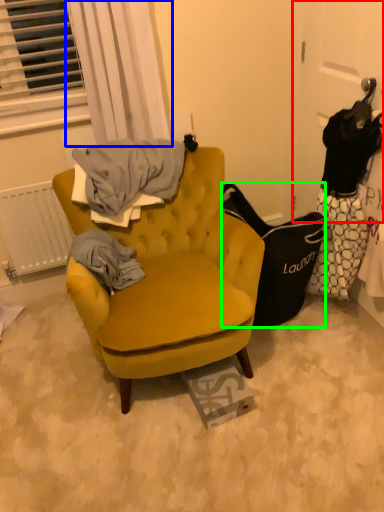
Question: Which is nearer to the door (highlighted by a red box)? curtain (highlighted by a blue box) or handbag (highlighted by a green box).

Choices:
 (A) curtain
 (B) handbag

Answer: (B)